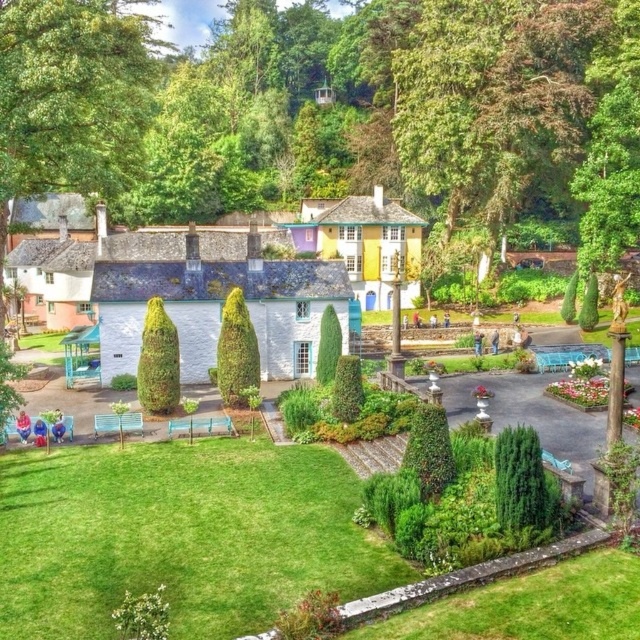
Question: Considering the relative positions of green grass at lower center and green textured hedge at center-left in the image provided, where is green grass at lower center located with respect to green textured hedge at center-left?

Choices:
 (A) above
 (B) below

Answer: (B)

Question: Which point is farther from the camera taking this photo?

Choices:
 (A) (148, 353)
 (B) (60, 564)
 (C) (236, 369)

Answer: (C)

Question: Observing the image, what is the correct spatial positioning of green grass at lower center in reference to green textured hedge at center-left?

Choices:
 (A) right
 (B) left

Answer: (A)

Question: Can you confirm if green textured hedge at center-left is smaller than green textured hedge at center?

Choices:
 (A) no
 (B) yes

Answer: (B)

Question: Which object appears closest to the camera in this image?

Choices:
 (A) green textured hedge at center-left
 (B) green textured hedge at center

Answer: (A)

Question: Which of the following is the farthest from the observer?

Choices:
 (A) (164, 342)
 (B) (220, 349)
 (C) (353, 584)

Answer: (B)